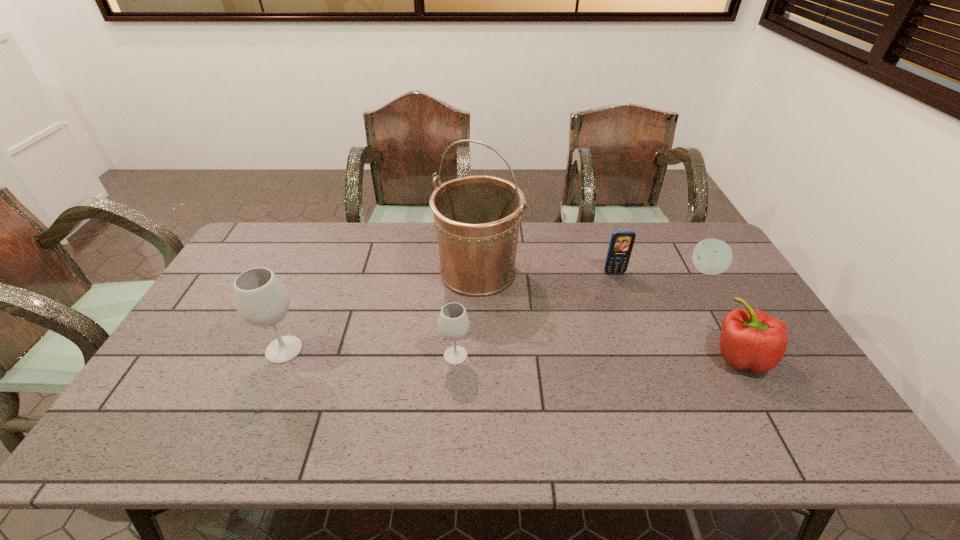
At what (x,y) coordinates should I click in order to perform the action: click on vacant space that's between the shortest object and the taller wineglass. Please return your answer as a coordinate pair (x, y). Looking at the image, I should click on (495, 310).

Where is `vacant area that lies between the bell pepper and the taller wineglass`? The height and width of the screenshot is (540, 960). vacant area that lies between the bell pepper and the taller wineglass is located at coordinates (513, 353).

Identify which object is located as the nearest to the fourth object from left to right. Please provide its 2D coordinates. Your answer should be formatted as a tuple, i.e. [(x, y)], where the tuple contains the x and y coordinates of a point satisfying the conditions above.

[(711, 256)]

Identify which object is located as the fifth nearest to the right wineglass. Please provide its 2D coordinates. Your answer should be formatted as a tuple, i.e. [(x, y)], where the tuple contains the x and y coordinates of a point satisfying the conditions above.

[(711, 256)]

Where is `vacant space that satisfies the following two spatial constraints: 1. on the back side of the right wineglass; 2. on the right side of the apple`? The height and width of the screenshot is (540, 960). vacant space that satisfies the following two spatial constraints: 1. on the back side of the right wineglass; 2. on the right side of the apple is located at coordinates (460, 270).

Find the location of a particular element. vacant point that satisfies the following two spatial constraints: 1. on the back side of the bucket; 2. on the left side of the taller wineglass is located at coordinates (318, 272).